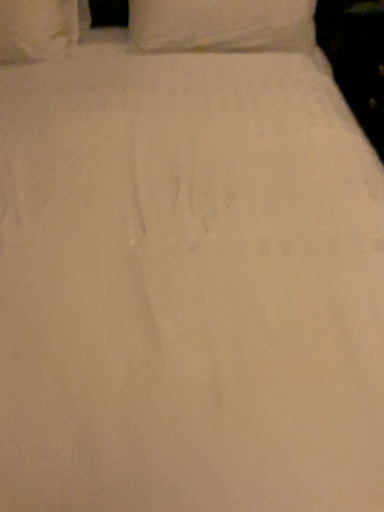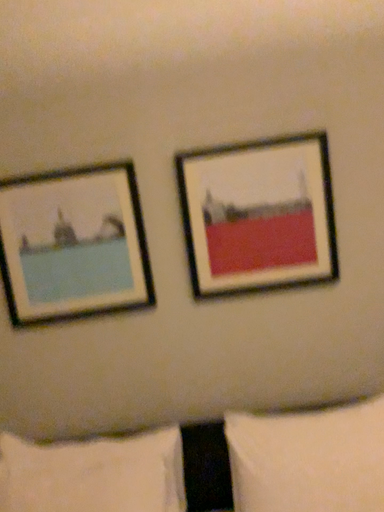
Question: Which way did the camera rotate in the video?

Choices:
 (A) rotated upward
 (B) rotated downward

Answer: (A)